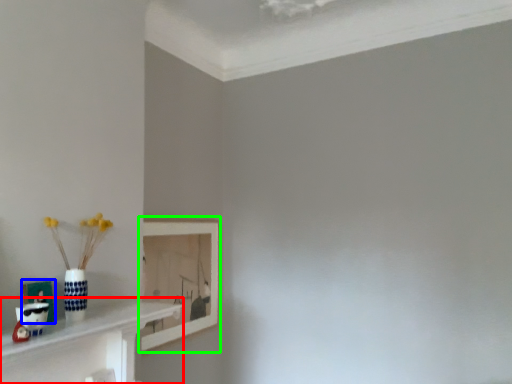
Question: Estimate the real-world distances between objects in this image. Which object is closer to shelf (highlighted by a red box), picture frame (highlighted by a blue box) or picture frame (highlighted by a green box)?

Choices:
 (A) picture frame
 (B) picture frame

Answer: (A)